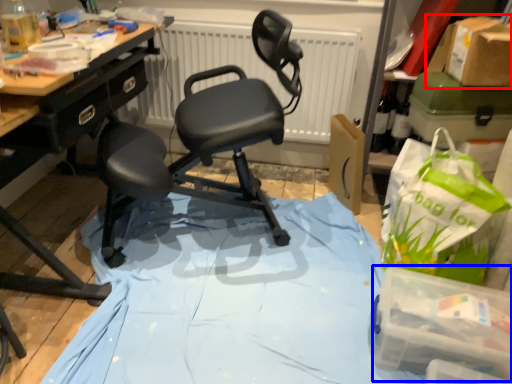
Question: Which object is further to the camera taking this photo, cardboard box (highlighted by a red box) or box (highlighted by a blue box)?

Choices:
 (A) cardboard box
 (B) box

Answer: (A)